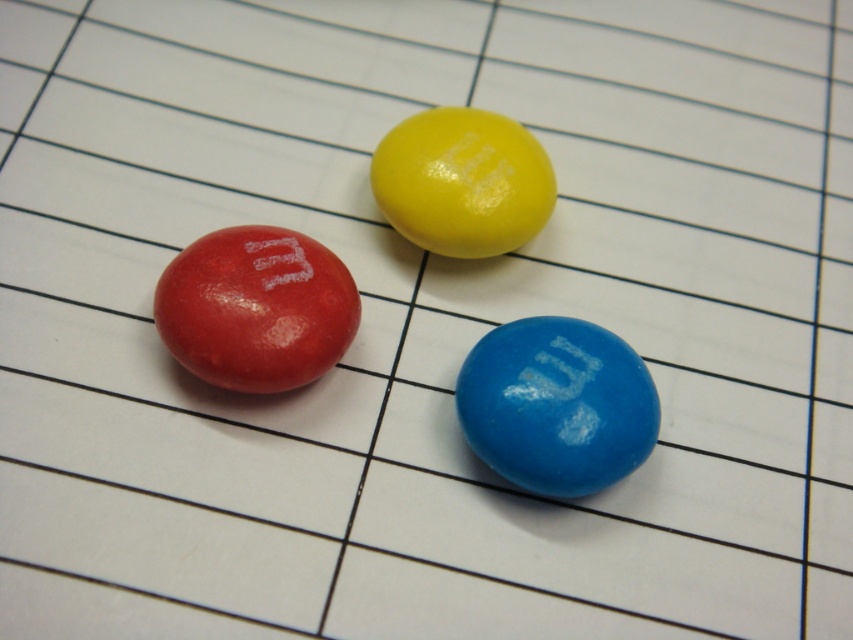
Question: Can you confirm if matte red m&m at upper left is smaller than glossy yellow m&m at upper center?

Choices:
 (A) no
 (B) yes

Answer: (B)

Question: Which of the following is the closest to the observer?

Choices:
 (A) (473, 426)
 (B) (262, 250)

Answer: (A)

Question: Which object appears farthest from the camera in this image?

Choices:
 (A) matte red m&m at upper left
 (B) blue glossy m&m at center

Answer: (A)

Question: Is blue glossy m&m at center thinner than glossy yellow m&m at upper center?

Choices:
 (A) yes
 (B) no

Answer: (B)

Question: Is blue glossy m&m at center thinner than glossy yellow m&m at upper center?

Choices:
 (A) no
 (B) yes

Answer: (A)

Question: Which point is closer to the camera?

Choices:
 (A) matte red m&m at upper left
 (B) blue glossy m&m at center
 (C) glossy yellow m&m at upper center

Answer: (B)